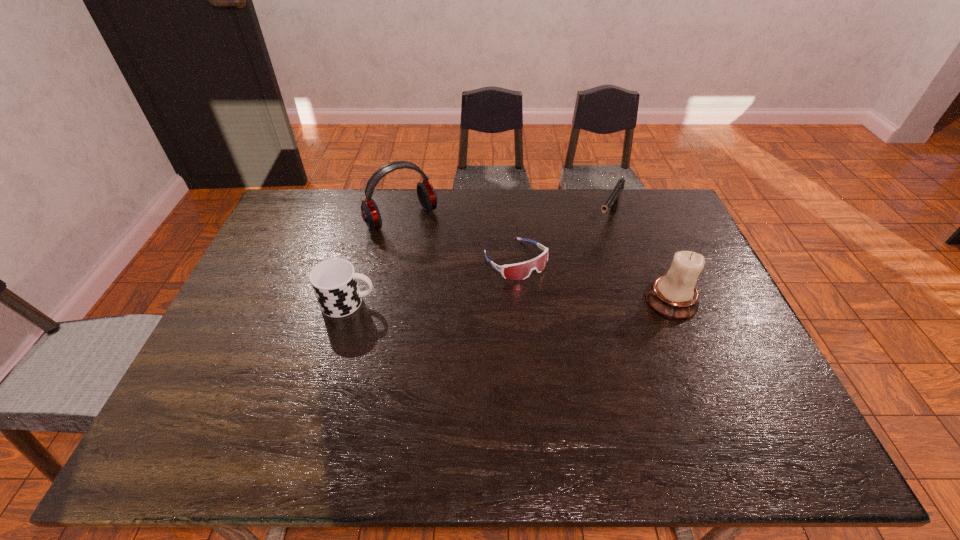
The image size is (960, 540). Find the location of `free spot at the far edge of the desktop`. free spot at the far edge of the desktop is located at coordinates (536, 222).

The image size is (960, 540). What are the coordinates of `vacant area at the left edge of the desktop` in the screenshot? It's located at (276, 292).

Identify the location of blank space at the right edge of the desktop. (689, 343).

Identify the location of vacant space at the far left corner. (325, 189).

I want to click on vacant space at the near left corner of the desktop, so click(x=234, y=409).

In the image, there is a desktop. Where is `vacant region at the near right corner`? vacant region at the near right corner is located at coordinates pos(743,388).

Where is `vacant area between the candle holder and the third object from left to right`? vacant area between the candle holder and the third object from left to right is located at coordinates (593, 280).

Identify the location of free spot between the third object from right to left and the candle holder. pos(593,280).

Locate an element on the screen. The width and height of the screenshot is (960, 540). free space between the candle holder and the cup is located at coordinates (510, 302).

The image size is (960, 540). I want to click on free point between the candle holder and the pistol, so click(x=639, y=260).